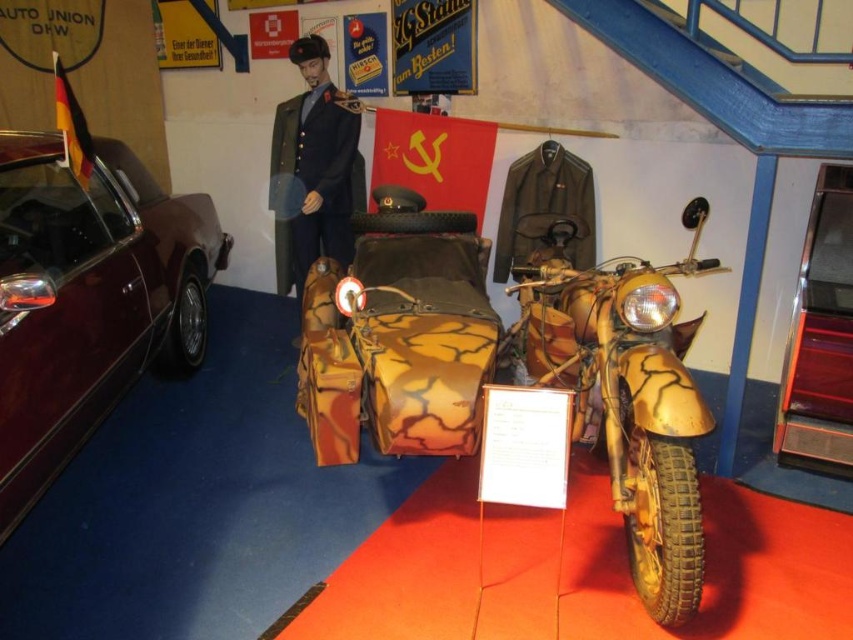
Does point (39, 285) come behind point (502, 198)?

No, (39, 285) is closer to viewer.

Is glossy maroon car at left smaller than matte black jacket at upper center?

No.

The width and height of the screenshot is (853, 640). Find the location of `glossy maroon car at left`. glossy maroon car at left is located at coordinates (88, 298).

Who is more forward, (125, 246) or (645, 404)?

Point (645, 404)

Can you confirm if glossy maroon car at left is shorter than camouflage paint motorcycle at center?

No.

Does point (4, 180) come behind point (631, 259)?

That is False.

Where is `glossy maroon car at left`? glossy maroon car at left is located at coordinates tap(88, 298).

Based on the photo, is glossy maroon car at left wider than dark blue uniform at center?

Indeed, glossy maroon car at left has a greater width compared to dark blue uniform at center.

The width and height of the screenshot is (853, 640). I want to click on glossy maroon car at left, so click(88, 298).